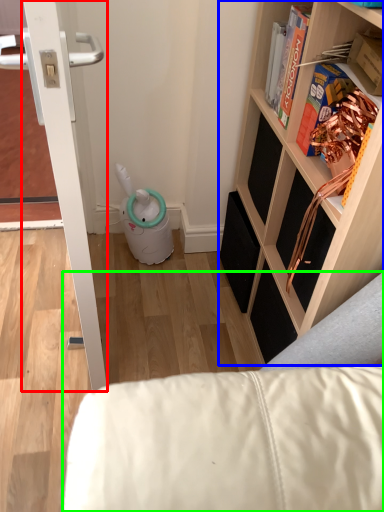
Question: Estimate the real-world distances between objects in this image. Which object is closer to door (highlighted by a red box), shelf (highlighted by a blue box) or furniture (highlighted by a green box)?

Choices:
 (A) shelf
 (B) furniture

Answer: (B)